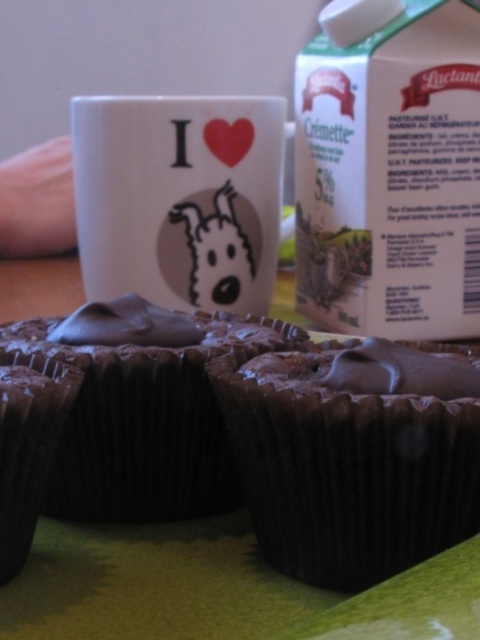
Does chocolate paper cupcake at center have a greater width compared to white matte mug at center?

Incorrect, chocolate paper cupcake at center's width does not surpass white matte mug at center's.

Measure the distance from chocolate paper cupcake at center to white matte mug at center.

60.44 centimeters

The width and height of the screenshot is (480, 640). Find the location of `chocolate paper cupcake at center`. chocolate paper cupcake at center is located at coordinates (350, 476).

You are a GUI agent. You are given a task and a screenshot of the screen. Output one action in this format:
    pyautogui.click(x=<x>, y=<y>)
    Task: Click on the chocolate paper cupcake at center
    The height and width of the screenshot is (640, 480).
    Given the screenshot: What is the action you would take?
    pyautogui.click(x=350, y=476)

Which is more to the left, white matte mug at center or chocolate matte cupcake at lower left?

chocolate matte cupcake at lower left is more to the left.

Who is more distant from viewer, (103, 216) or (51, 436)?

The point (103, 216) is behind.

Where is `white matte mug at center`? white matte mug at center is located at coordinates (179, 196).

Which of these two, chocolate matte muffin at center or chocolate paper cupcake at center, stands taller?

Standing taller between the two is chocolate matte muffin at center.

Is chocolate matte muffin at center positioned at the back of chocolate paper cupcake at center?

No, chocolate matte muffin at center is closer to the viewer.

Is point (375, 582) in front of point (431, 408)?

No, (375, 582) is further to viewer.

Find the location of a particular element. This screenshot has width=480, height=640. chocolate matte muffin at center is located at coordinates (231, 452).